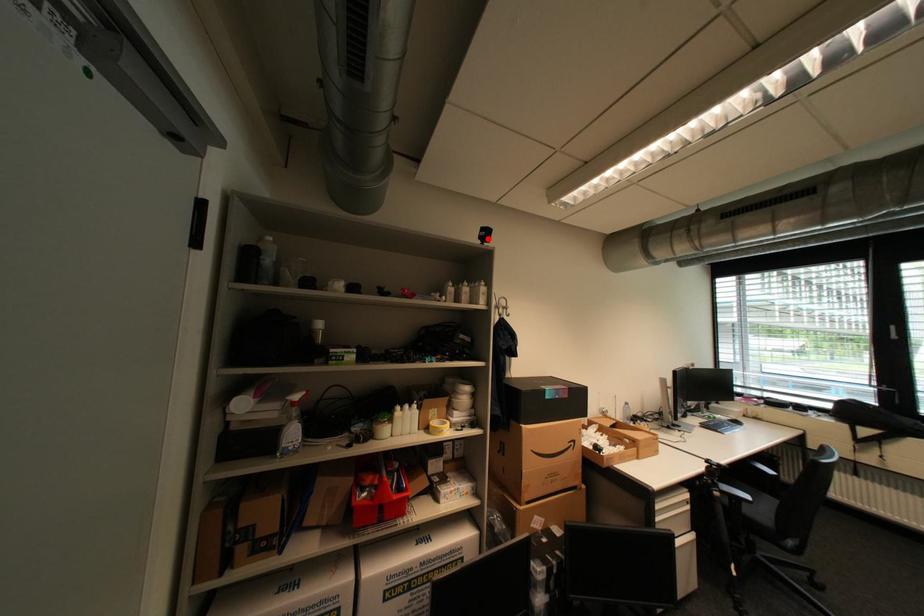
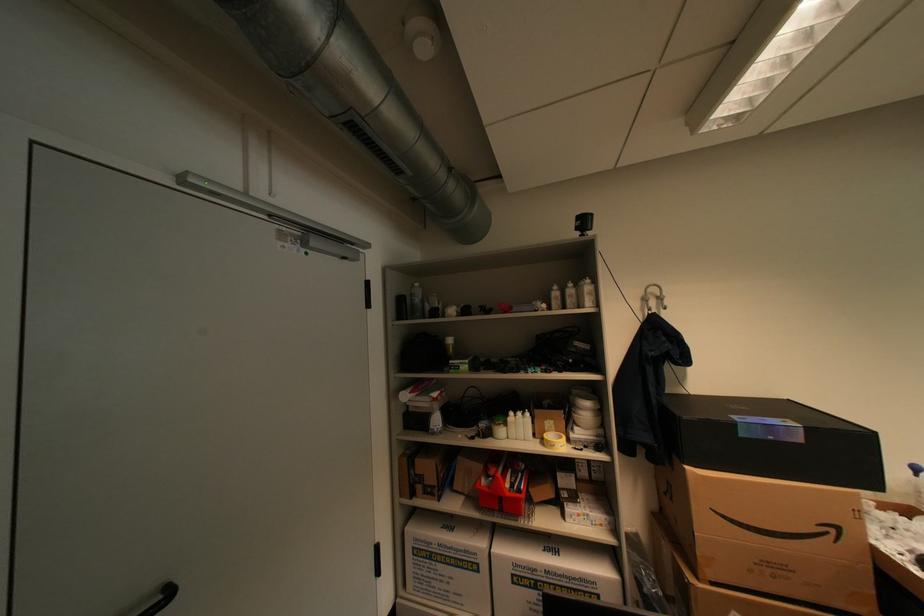
Locate, in the second image, the point that corresponds to the highlighted location in the first image.

(586, 230)